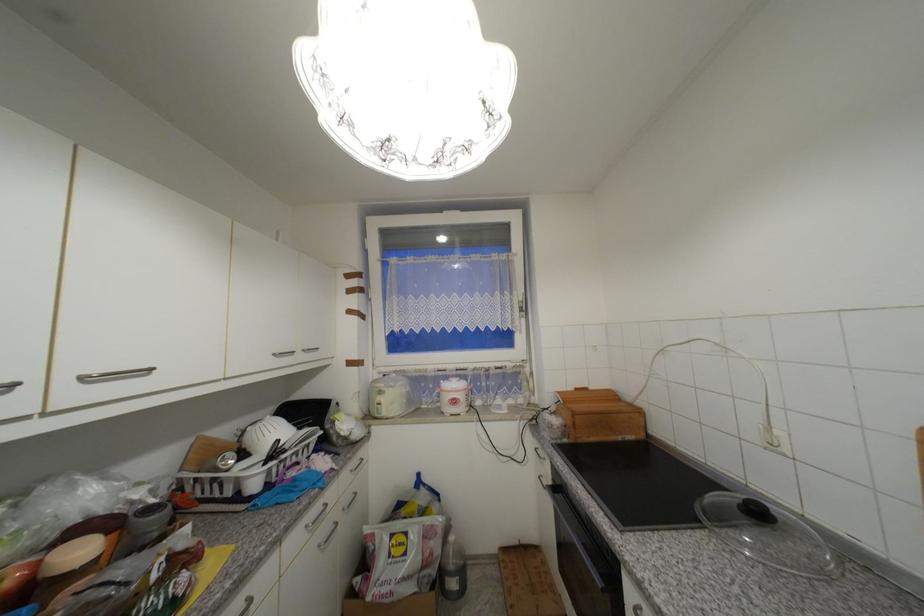
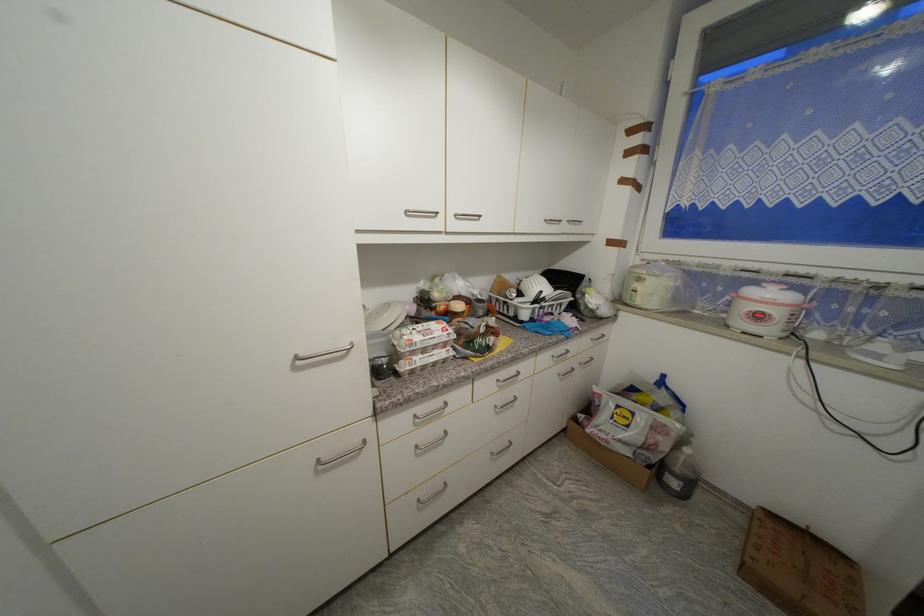
The first image is from the beginning of the video and the second image is from the end. How did the camera likely rotate when shooting the video?

The camera rotated toward left-down.